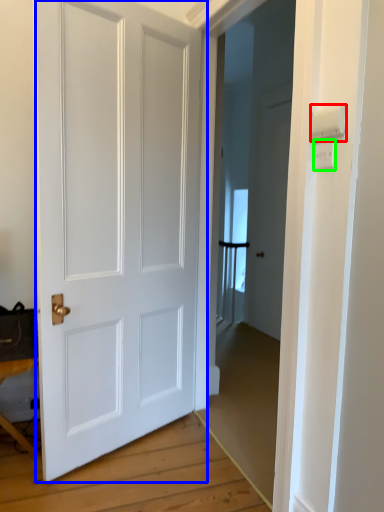
Question: Considering the real-world distances, which object is closest to light switch (highlighted by a red box)? door (highlighted by a blue box) or light switch (highlighted by a green box).

Choices:
 (A) door
 (B) light switch

Answer: (B)